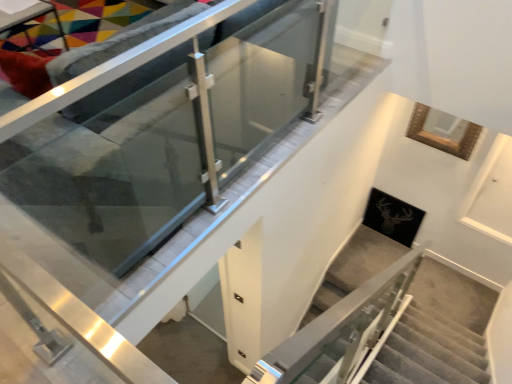
The width and height of the screenshot is (512, 384). Identify the location of transparent glass door at upper left. (168, 133).

What do you see at coordinates (168, 133) in the screenshot? Image resolution: width=512 pixels, height=384 pixels. I see `transparent glass door at upper left` at bounding box center [168, 133].

In order to click on transparent glass door at upper left in this screenshot , I will do [168, 133].